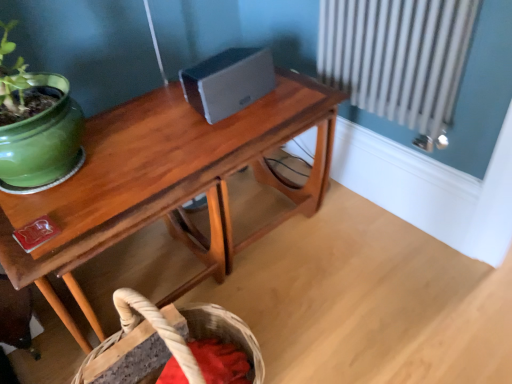
Question: Can you confirm if woven natural fiber basket at lower center is positioned to the right of wooden table at center?

Choices:
 (A) no
 (B) yes

Answer: (A)

Question: Is woven natural fiber basket at lower center taller than wooden table at center?

Choices:
 (A) yes
 (B) no

Answer: (B)

Question: Is woven natural fiber basket at lower center oriented towards wooden table at center?

Choices:
 (A) yes
 (B) no

Answer: (B)

Question: Is wooden table at center at the back of woven natural fiber basket at lower center?

Choices:
 (A) yes
 (B) no

Answer: (A)

Question: Is woven natural fiber basket at lower center directly adjacent to wooden table at center?

Choices:
 (A) yes
 (B) no

Answer: (B)

Question: From a real-world perspective, is woven natural fiber basket at lower center over wooden table at center?

Choices:
 (A) no
 (B) yes

Answer: (A)

Question: Is wooden table at center positioned before woven natural fiber basket at lower center?

Choices:
 (A) no
 (B) yes

Answer: (B)

Question: Can we say wooden table at center lies outside woven natural fiber basket at lower center?

Choices:
 (A) yes
 (B) no

Answer: (A)

Question: Can you confirm if wooden table at center is bigger than woven natural fiber basket at lower center?

Choices:
 (A) no
 (B) yes

Answer: (B)

Question: Could you tell me if wooden table at center is turned towards woven natural fiber basket at lower center?

Choices:
 (A) yes
 (B) no

Answer: (A)

Question: Is wooden table at center in contact with woven natural fiber basket at lower center?

Choices:
 (A) no
 (B) yes

Answer: (A)

Question: From the image's perspective, does wooden table at center appear higher than woven natural fiber basket at lower center?

Choices:
 (A) yes
 (B) no

Answer: (A)

Question: Is woven natural fiber basket at lower center taller or shorter than wooden table at center?

Choices:
 (A) tall
 (B) short

Answer: (B)